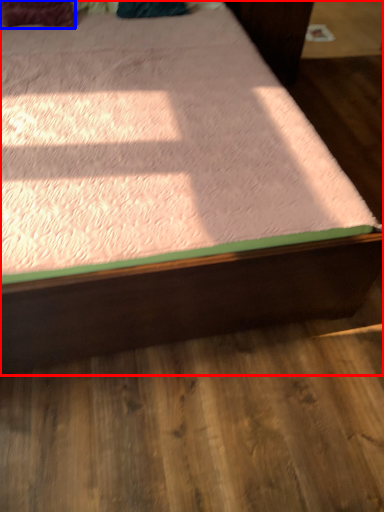
Question: Which object appears farthest to the camera in this image, bed (highlighted by a red box) or pillow (highlighted by a blue box)?

Choices:
 (A) bed
 (B) pillow

Answer: (B)